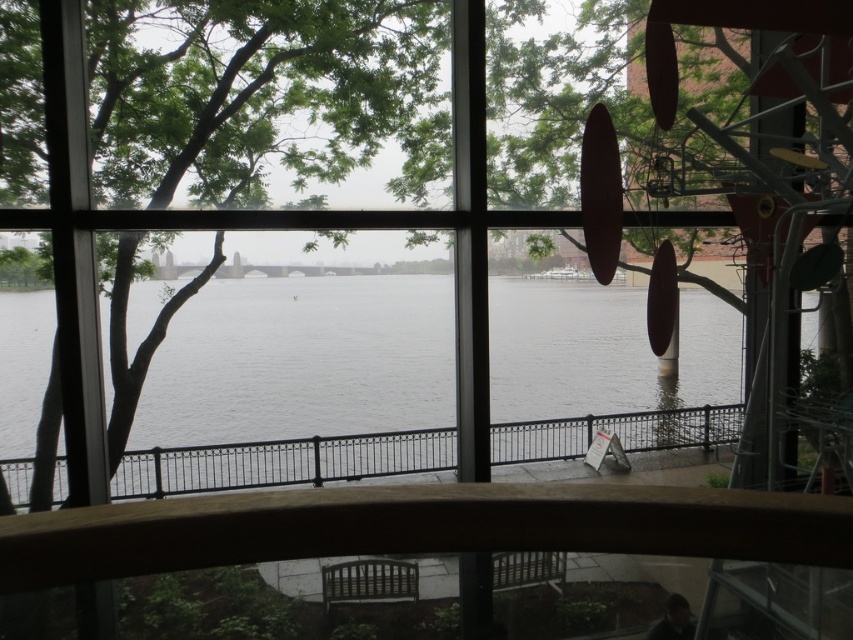
Question: Is the position of gray water at center less distant than that of black metal railing at center?

Choices:
 (A) yes
 (B) no

Answer: (B)

Question: Which of the following is the closest to the observer?

Choices:
 (A) gray water at center
 (B) black metal railing at center

Answer: (B)

Question: Does gray water at center have a lesser width compared to black metal railing at center?

Choices:
 (A) no
 (B) yes

Answer: (A)

Question: In this image, where is gray water at center located relative to black metal railing at center?

Choices:
 (A) left
 (B) right

Answer: (B)